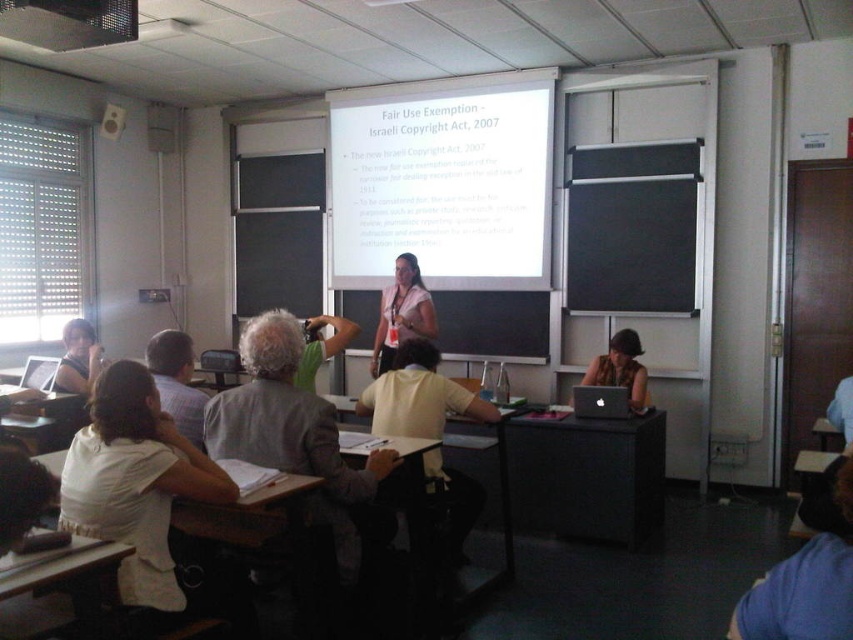
Question: Which object is closer to the camera taking this photo?

Choices:
 (A) matte black laptop at lower right
 (B) matte black shirt at left
 (C) matte pink shirt at center

Answer: (A)

Question: Can you confirm if white cotton shirt at lower left is positioned to the right of matte black shirt at left?

Choices:
 (A) yes
 (B) no

Answer: (A)

Question: Which of these objects is positioned closest to the white matte projection screen at upper center?

Choices:
 (A) matte black laptop at lower right
 (B) white cotton shirt at lower left
 (C) matte pink shirt at center
 (D) matte black shirt at left

Answer: (C)

Question: Is matte pink shirt at center to the left of matte black laptop at lower right from the viewer's perspective?

Choices:
 (A) yes
 (B) no

Answer: (A)

Question: Which of these objects is positioned closest to the matte black shirt at left?

Choices:
 (A) white cotton shirt at lower left
 (B) matte pink shirt at center
 (C) matte black laptop at lower right

Answer: (B)

Question: Is matte pink shirt at center smaller than matte black shirt at left?

Choices:
 (A) no
 (B) yes

Answer: (A)